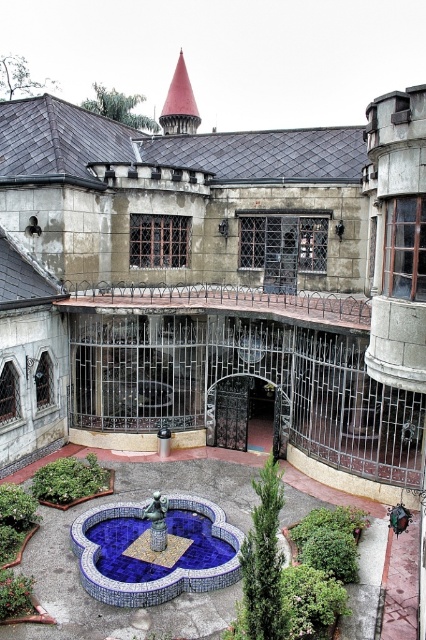
Does blue mosaic fountain at center have a greater width compared to green leafy bush at center?

Indeed, blue mosaic fountain at center has a greater width compared to green leafy bush at center.

Does blue mosaic fountain at center have a larger size compared to green leafy bush at center?

Yes.

This screenshot has height=640, width=426. What do you see at coordinates (127, 609) in the screenshot?
I see `blue mosaic fountain at center` at bounding box center [127, 609].

At what (x,y) coordinates should I click in order to perform the action: click on blue mosaic fountain at center. Please return your answer as a coordinate pair (x, y). Looking at the image, I should click on [x=127, y=609].

Is the position of stone castle at center less distant than that of blue mosaic fountain at center?

No, it is behind blue mosaic fountain at center.

Between point (348, 420) and point (215, 499), which one is positioned in front?

Point (215, 499) is more forward.

The image size is (426, 640). Identify the location of stone castle at center. (215, 280).

Where is `stone castle at center`? This screenshot has height=640, width=426. stone castle at center is located at coordinates (215, 280).

Image resolution: width=426 pixels, height=640 pixels. Find the location of `stone castle at center`. stone castle at center is located at coordinates (215, 280).

Measure the distance between stone castle at center and green leafy bush at center.

They are 23.82 feet apart.

Between point (83, 353) and point (57, 472), which one is positioned behind?

The point (83, 353) is behind.

This screenshot has width=426, height=640. Identify the location of stone castle at center. (215, 280).